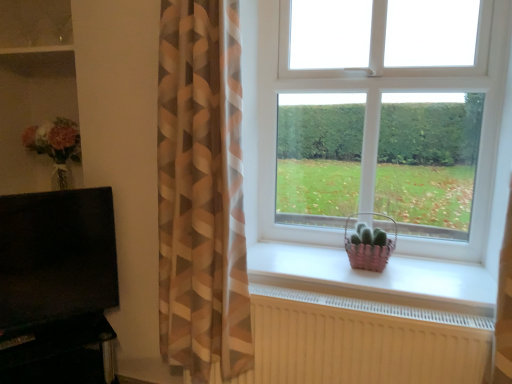
Image resolution: width=512 pixels, height=384 pixels. Find the location of `vacant region in front of pink woven basket at window`. vacant region in front of pink woven basket at window is located at coordinates (377, 280).